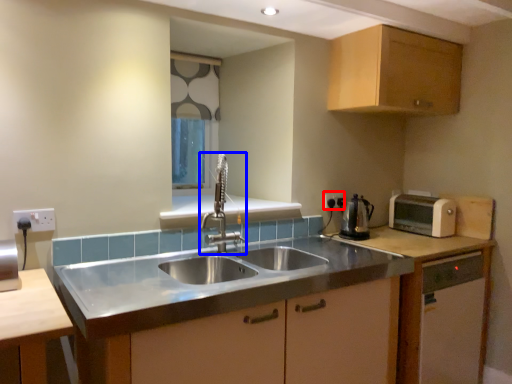
Question: Which object is closer to the camera taking this photo, electric outlet (highlighted by a red box) or tap (highlighted by a blue box)?

Choices:
 (A) electric outlet
 (B) tap

Answer: (B)